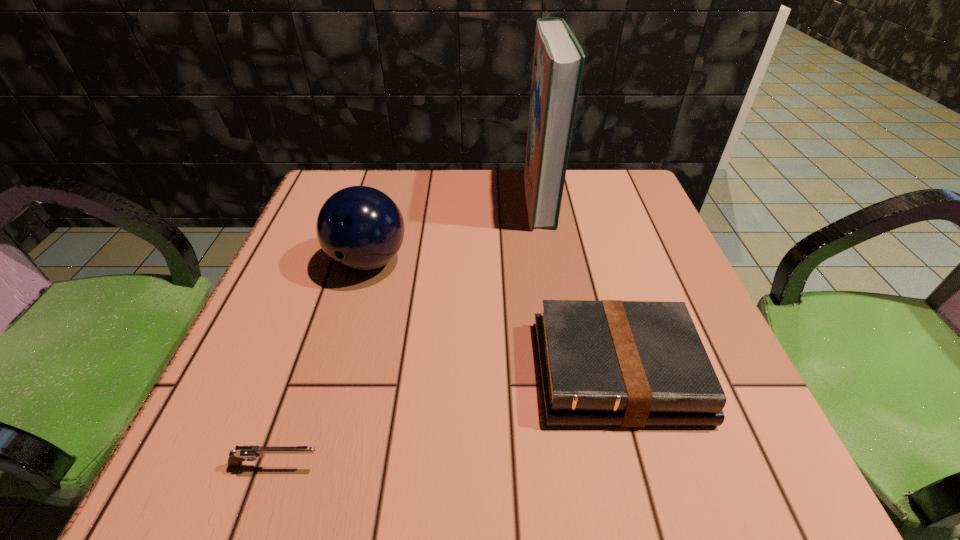
You are a GUI agent. You are given a task and a screenshot of the screen. Output one action in this format:
    pyautogui.click(x=<x>, y=<y>)
    Task: Click on the vacant space that's between the third shortest object and the third tallest object
    
    Given the screenshot: What is the action you would take?
    pyautogui.click(x=492, y=316)

This screenshot has width=960, height=540. Find the location of `free space between the shortest object and the bowling ball`. free space between the shortest object and the bowling ball is located at coordinates (323, 363).

Where is `vacant area between the pistol and the farthest object`? The height and width of the screenshot is (540, 960). vacant area between the pistol and the farthest object is located at coordinates (408, 332).

Image resolution: width=960 pixels, height=540 pixels. I want to click on free space between the taller hardback book and the third farthest object, so click(x=578, y=285).

The width and height of the screenshot is (960, 540). I want to click on free space between the pistol and the second farthest object, so click(x=323, y=363).

Find the location of a particular element. This screenshot has height=540, width=960. free space between the second farthest object and the third tallest object is located at coordinates (492, 316).

What are the coordinates of `free space between the farthest object and the nearest object` in the screenshot? It's located at tap(408, 332).

This screenshot has width=960, height=540. I want to click on free point between the pistol and the bowling ball, so click(x=323, y=363).

The image size is (960, 540). Find the location of `free space that is in between the farther hardback book and the nearest object`. free space that is in between the farther hardback book and the nearest object is located at coordinates (408, 332).

Where is `the closest object to the farthest object`? Image resolution: width=960 pixels, height=540 pixels. the closest object to the farthest object is located at coordinates (360, 228).